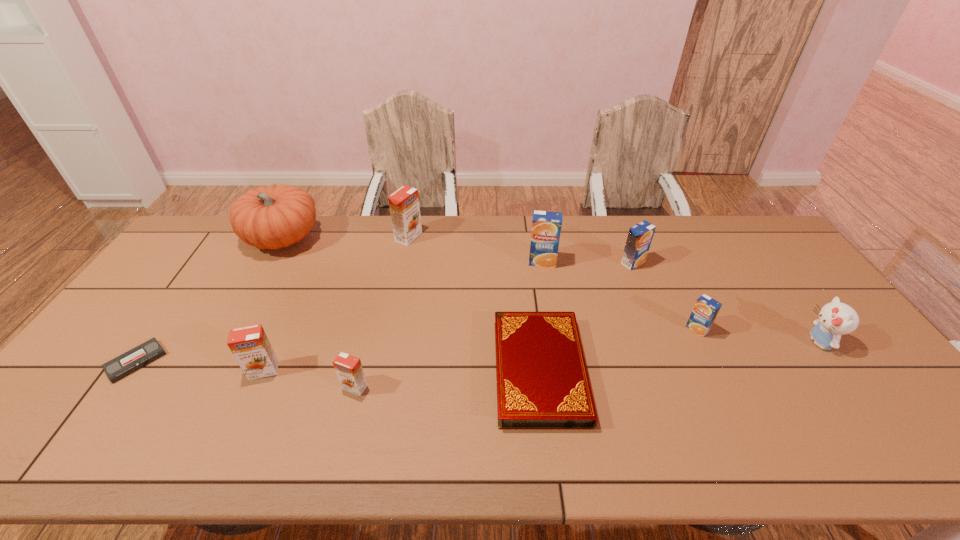
Find the location of a particular element. The width and height of the screenshot is (960, 540). the fourth farthest orange juice is located at coordinates (706, 309).

Locate an element on the screen. Image resolution: width=960 pixels, height=540 pixels. the rightmost blue orange_juice is located at coordinates (706, 309).

Where is `the smallest orange orange juice`? the smallest orange orange juice is located at coordinates (348, 368).

Where is `the second shortest object`? the second shortest object is located at coordinates (542, 379).

Locate an element on the screen. the leftmost object is located at coordinates (129, 362).

Image resolution: width=960 pixels, height=540 pixels. In order to click on the shortest object in this screenshot , I will do (129, 362).

Identify the location of vacant space located 0.110m on the front of the pumpkin. (257, 286).

Identify the location of vacant space located on the front of the farthest orange juice. (397, 294).

This screenshot has width=960, height=540. I want to click on vacant space located on the front of the leftmost blue orange_juice, so click(551, 313).

You are a GUI agent. You are given a task and a screenshot of the screen. Output one action in this format:
    pyautogui.click(x=<x>, y=<y>)
    Task: Click on the vacant area situated on the left of the second blue orange_juice from right to left
    This screenshot has width=960, height=540.
    Given the screenshot: What is the action you would take?
    click(x=505, y=262)